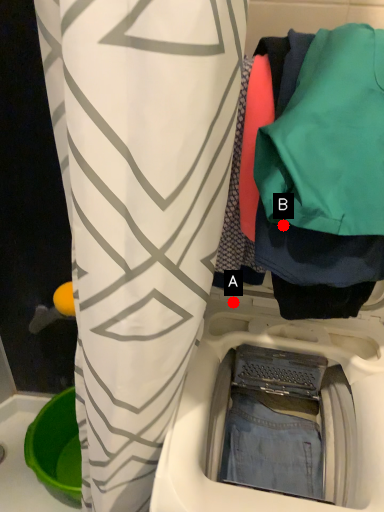
Question: Two points are circled on the image, labeled by A and B beside each circle. Which point is closer to the camera?

Choices:
 (A) A is closer
 (B) B is closer

Answer: (B)